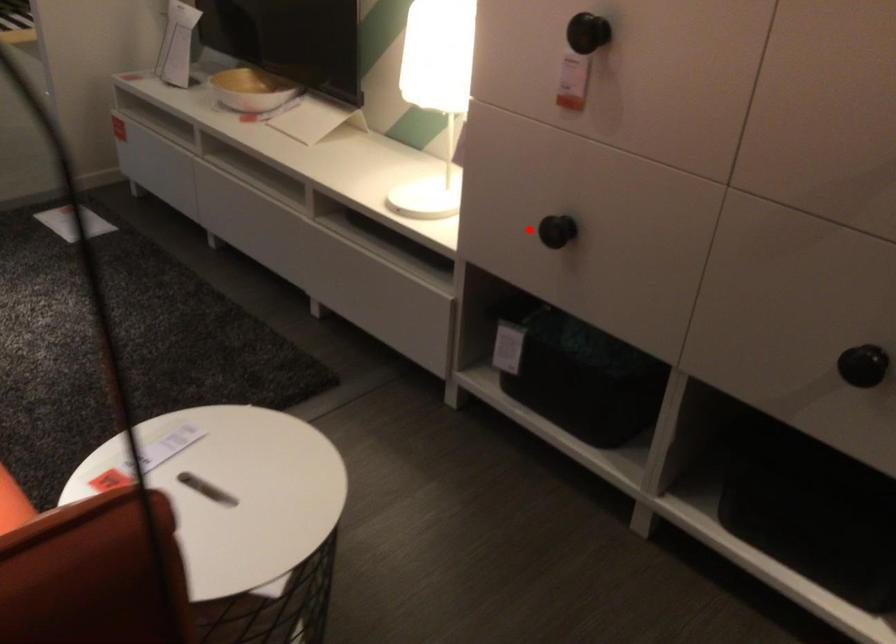
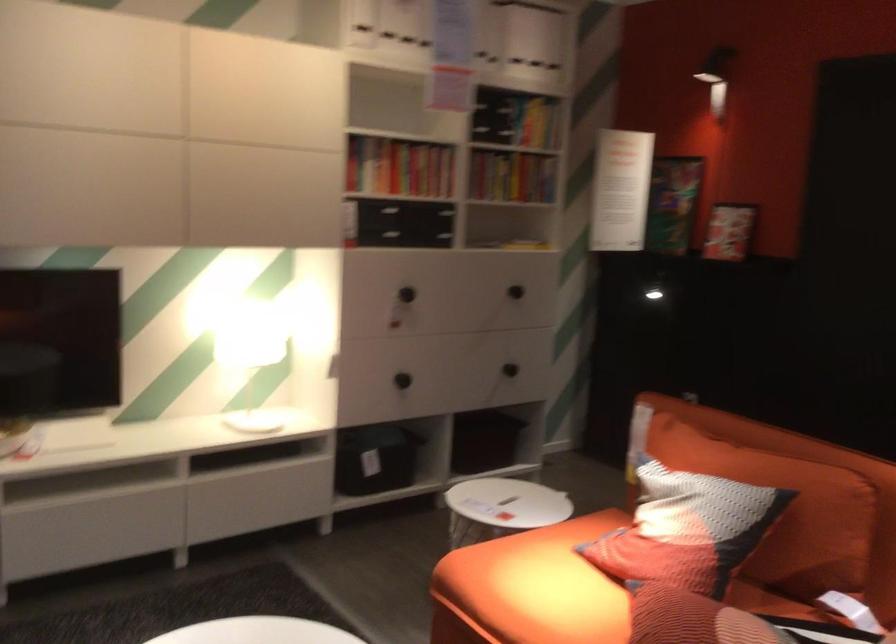
Question: I am providing you with two images of the same scene from different viewpoints. In image1, a red point is highlighted. Considering the same 3D point in image2, which of the following is correct?

Choices:
 (A) It is closer
 (B) It is farther

Answer: (B)